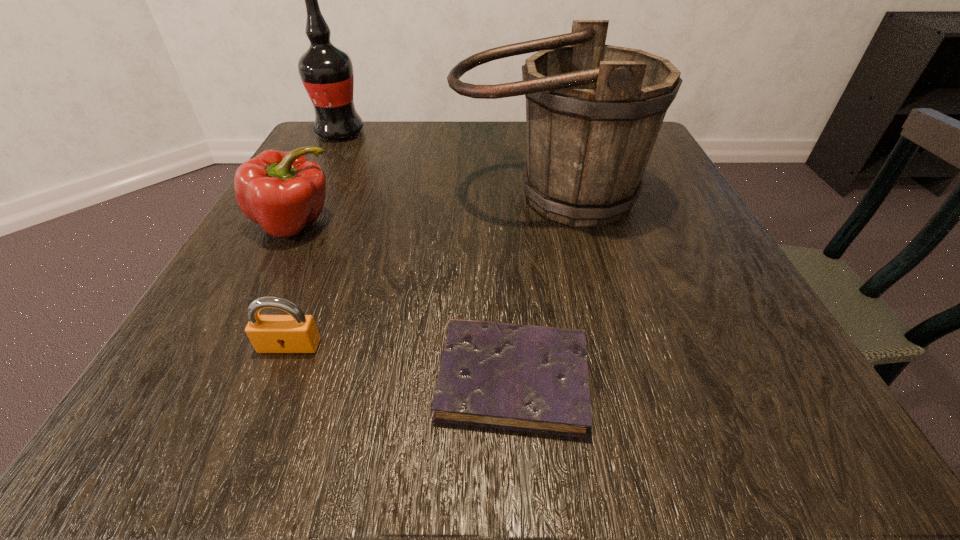
Identify the location of the farthest object. (326, 71).

At what (x,y) coordinates should I click in order to perform the action: click on the second tallest object. Please return your answer as a coordinate pair (x, y). The height and width of the screenshot is (540, 960). Looking at the image, I should click on (593, 111).

At what (x,y) coordinates should I click in order to perform the action: click on pepper. Please return your answer as a coordinate pair (x, y). Looking at the image, I should click on (282, 191).

Image resolution: width=960 pixels, height=540 pixels. I want to click on the fourth tallest object, so click(x=296, y=333).

Image resolution: width=960 pixels, height=540 pixels. I want to click on diary, so click(x=529, y=378).

You are a GUI agent. You are given a task and a screenshot of the screen. Output one action in this format:
    pyautogui.click(x=<x>, y=<y>)
    Task: Click on the vacant position located on the front of the farthest object
    
    Given the screenshot: What is the action you would take?
    pyautogui.click(x=315, y=182)

At what (x,y) coordinates should I click in order to perform the action: click on free region located 0.150m on the handle side of the fourth shortest object. Please return your answer as a coordinate pair (x, y). The width and height of the screenshot is (960, 540). Looking at the image, I should click on (568, 303).

Image resolution: width=960 pixels, height=540 pixels. Identify the location of free space located on the right of the pepper. (444, 224).

Identify the location of vacant space situated on the left of the diary. The image size is (960, 540). (335, 378).

Where is `wine bottle present at the far edge`? The height and width of the screenshot is (540, 960). wine bottle present at the far edge is located at coordinates (326, 71).